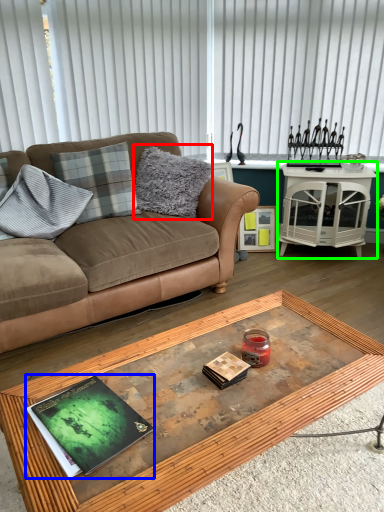
Question: Based on their relative distances, which object is nearer to pillow (highlighted by a red box)? Choose from magazine (highlighted by a blue box) and table (highlighted by a green box).

Choices:
 (A) magazine
 (B) table

Answer: (B)